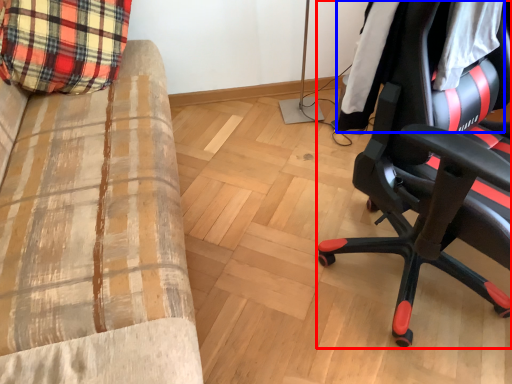
Question: Which object is further to the camera taking this photo, chair (highlighted by a red box) or clothing (highlighted by a blue box)?

Choices:
 (A) chair
 (B) clothing

Answer: (B)